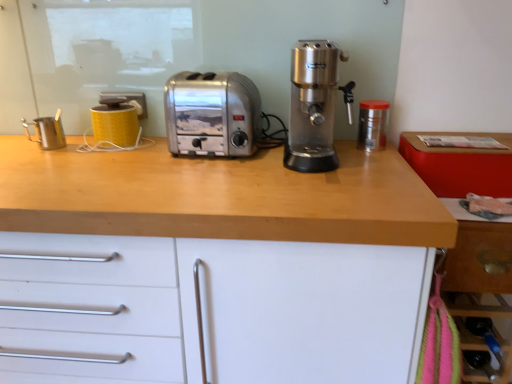
Question: Is point (295, 115) positioned closer to the camera than point (358, 253)?

Choices:
 (A) farther
 (B) closer

Answer: (A)

Question: From a real-world perspective, is satin silver coffee machine at center above or below wooden countertop at center?

Choices:
 (A) below
 (B) above

Answer: (B)

Question: Estimate the real-world distances between objects in this image. Which object is farther from the yellow matte mug at upper left, which is the 2th kitchen appliance in left-to-right order?

Choices:
 (A) wooden drawer at lower right
 (B) satin silver toaster at center
 (C) metallic stainless steel pitcher at left, positioned as the third kitchen appliance in right-to-left order
 (D) satin silver coffee machine at center
 (E) transparent plastic container at right, arranged as the 3th kitchen appliance when viewed from the left

Answer: (A)

Question: Considering the real-world distances, which object is farthest from the yellow matte mug at upper left, which ranks as the second kitchen appliance in right-to-left order?

Choices:
 (A) wooden drawer at lower right
 (B) metallic stainless steel pitcher at left, which ranks as the first kitchen appliance in left-to-right order
 (C) satin silver coffee machine at center
 (D) transparent plastic container at right, the 1th kitchen appliance in the right-to-left sequence
 (E) wooden countertop at center

Answer: (A)